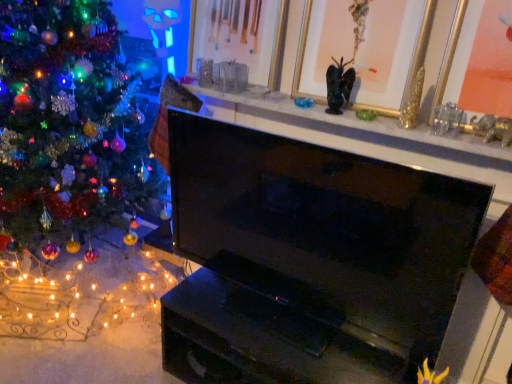
Question: From a real-world perspective, relative to shiny multicolored ornaments at left, is gold/gilded picture frame at upper center, the 2th picture frame from the left, vertically above or below?

Choices:
 (A) above
 (B) below

Answer: (A)

Question: Looking at their shapes, would you say gold/gilded picture frame at upper center, which is the 2th picture frame from right to left, is wider or thinner than shiny multicolored ornaments at left?

Choices:
 (A) wide
 (B) thin

Answer: (B)

Question: Which object is positioned closest to the gold/gilded picture frame at upper center, the 2th picture frame from the left?

Choices:
 (A) shiny multicolored ornaments at left
 (B) matte black fireplace at upper center
 (C) gold metallic picture frame at upper right, the third picture frame positioned from the left
 (D) gold-framed picture at upper center, the 3th picture frame when ordered from right to left
 (E) black glossy tv at center

Answer: (D)

Question: Which object is positioned farthest from the shiny multicolored ornaments at left?

Choices:
 (A) gold metallic picture frame at upper right, which appears as the first picture frame when viewed from the right
 (B) gold-framed picture at upper center, the 3th picture frame when ordered from right to left
 (C) black glossy tv at center
 (D) gold/gilded picture frame at upper center, the 2th picture frame from the left
 (E) matte black fireplace at upper center

Answer: (A)